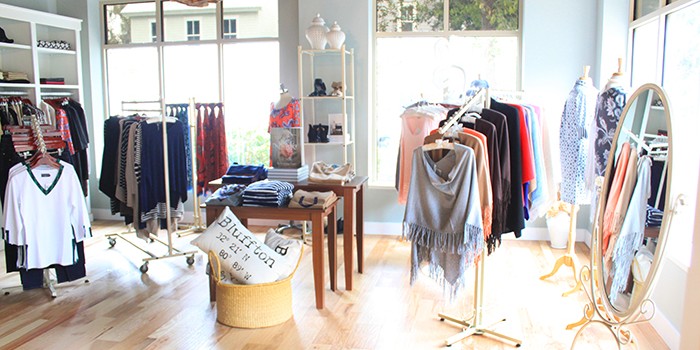
Locate an element on the screen. This screenshot has height=350, width=700. hardwood floor is located at coordinates (164, 327).